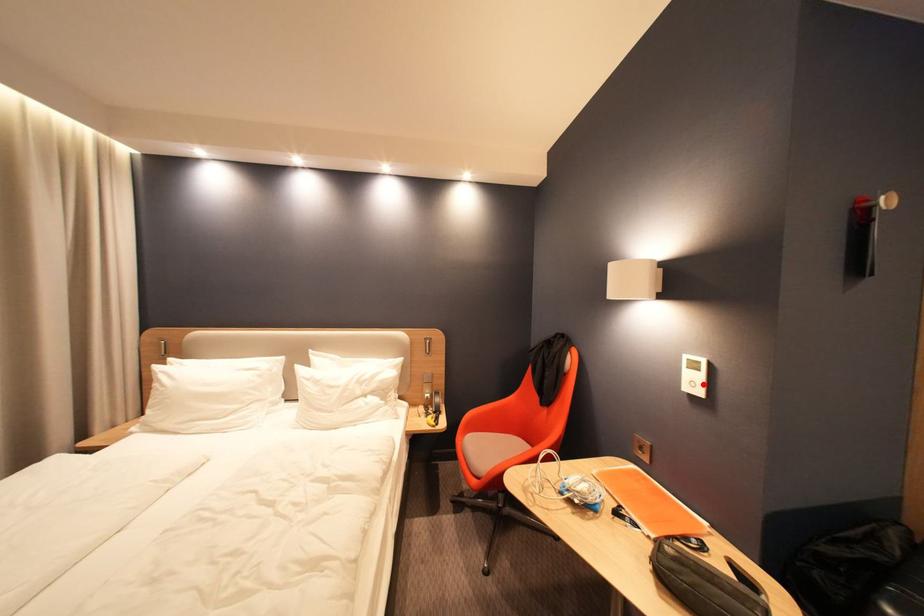
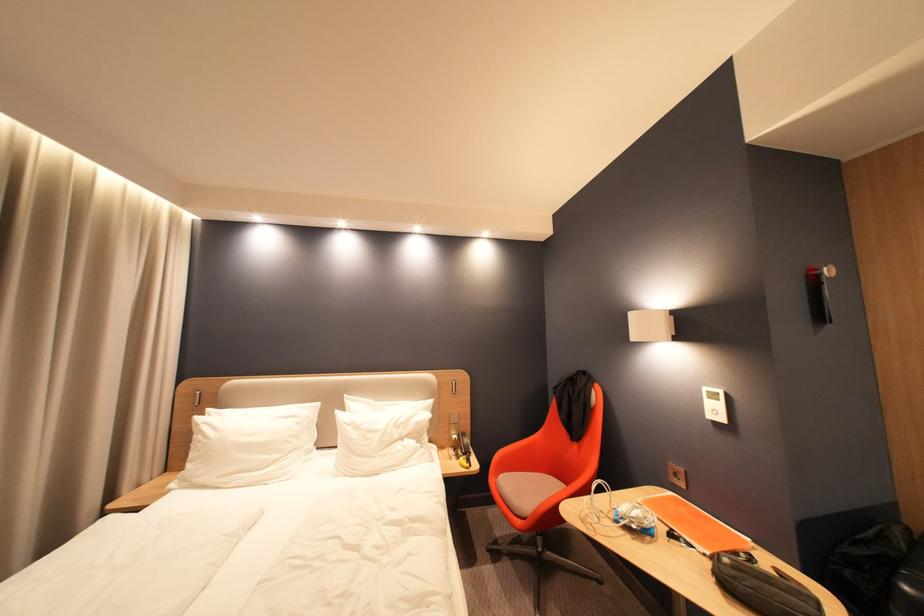
Locate, in the second image, the point that corresponds to the highlighted location in the first image.

(724, 413)